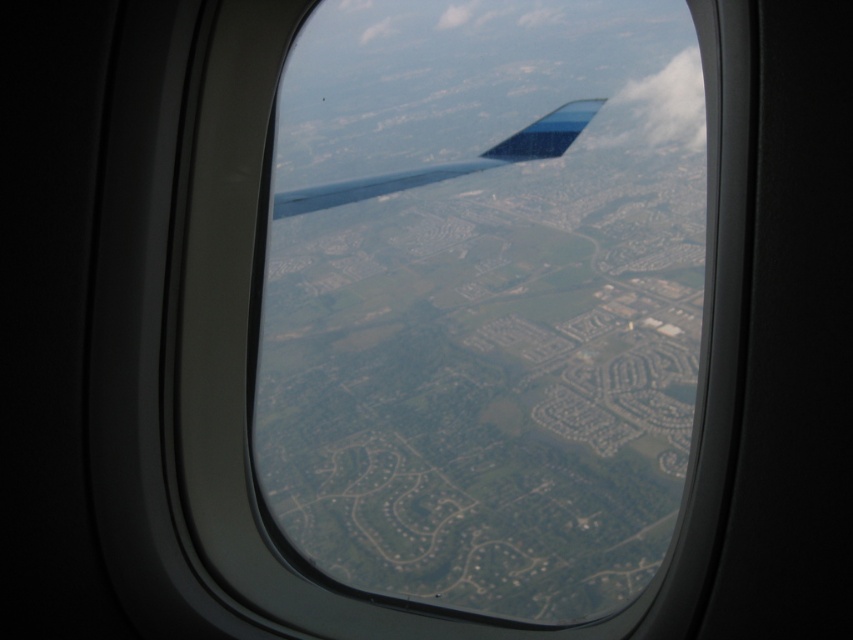
From the picture: You are a passenger on an airplane and looking out the window. You see a white fluffy cloud at upper right and a metallic blue wing at center. Which object is located more to the right side?

The white fluffy cloud at upper right is more to the right side than the metallic blue wing at center because it is positioned on the right side of the metallic blue wing at center.

You are sitting in the airplane and looking through the window. You see two points marked on the window. The first point is at coordinate point (x=689, y=138) and the second is at point (x=498, y=156). Which point is closer to your eyes?

Point (x=689, y=138) is further to the camera than point (x=498, y=156), so the point closer to your eyes is point (x=498, y=156).

Based on the photo, you are a passenger sitting in the airplane and looking out the window. You notice a point marked at coordinates (654, 109) on the window frame. What object does this point correspond to?

The point at coordinates (654, 109) corresponds to a white fluffy cloud at upper right.